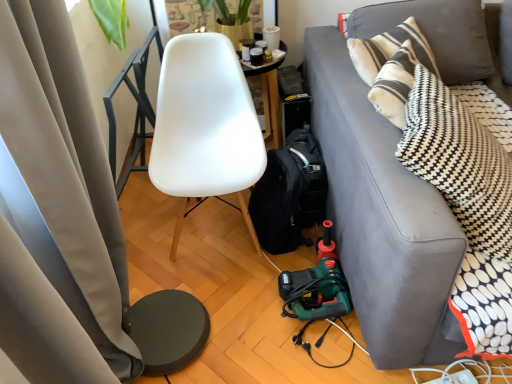
What are the coordinates of `free area in between matte gray curtain at left and white matte chair at center` in the screenshot? It's located at tap(211, 278).